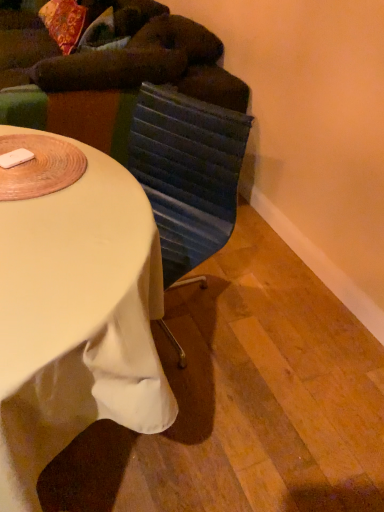
Question: From the image's perspective, does dark green fabric bean bag chair at upper left appear higher than white fabric-covered desk at center?

Choices:
 (A) yes
 (B) no

Answer: (A)

Question: Is dark green fabric bean bag chair at upper left further to camera compared to white fabric-covered desk at center?

Choices:
 (A) no
 (B) yes

Answer: (B)

Question: Can you confirm if dark green fabric bean bag chair at upper left is positioned to the left of white fabric-covered desk at center?

Choices:
 (A) yes
 (B) no

Answer: (A)

Question: From a real-world perspective, is dark green fabric bean bag chair at upper left physically above white fabric-covered desk at center?

Choices:
 (A) yes
 (B) no

Answer: (A)

Question: Considering the relative sizes of dark green fabric bean bag chair at upper left and white fabric-covered desk at center in the image provided, is dark green fabric bean bag chair at upper left wider than white fabric-covered desk at center?

Choices:
 (A) yes
 (B) no

Answer: (A)

Question: From their relative heights in the image, would you say white fabric-covered desk at center is taller or shorter than dark green fabric bean bag chair at upper left?

Choices:
 (A) tall
 (B) short

Answer: (B)

Question: From the image's perspective, relative to dark green fabric bean bag chair at upper left, is white fabric-covered desk at center above or below?

Choices:
 (A) above
 (B) below

Answer: (B)

Question: Looking at their shapes, would you say white fabric-covered desk at center is wider or thinner than dark green fabric bean bag chair at upper left?

Choices:
 (A) wide
 (B) thin

Answer: (B)

Question: Looking at the image, does white fabric-covered desk at center seem bigger or smaller compared to dark green fabric bean bag chair at upper left?

Choices:
 (A) big
 (B) small

Answer: (B)

Question: In the image, is dark green fabric bean bag chair at upper left on the left side or the right side of white fabric-covered desk at center?

Choices:
 (A) left
 (B) right

Answer: (A)

Question: Looking at the image, does dark green fabric bean bag chair at upper left seem bigger or smaller compared to white fabric-covered desk at center?

Choices:
 (A) small
 (B) big

Answer: (B)

Question: Which is correct: dark green fabric bean bag chair at upper left is inside white fabric-covered desk at center, or outside of it?

Choices:
 (A) outside
 (B) inside

Answer: (A)

Question: Is dark green fabric bean bag chair at upper left wider or thinner than white fabric-covered desk at center?

Choices:
 (A) wide
 (B) thin

Answer: (A)

Question: Considering the positions of dark green fabric bean bag chair at upper left and textured blue swivel chair at center in the image, is dark green fabric bean bag chair at upper left wider or thinner than textured blue swivel chair at center?

Choices:
 (A) wide
 (B) thin

Answer: (A)

Question: Is dark green fabric bean bag chair at upper left taller or shorter than textured blue swivel chair at center?

Choices:
 (A) tall
 (B) short

Answer: (A)